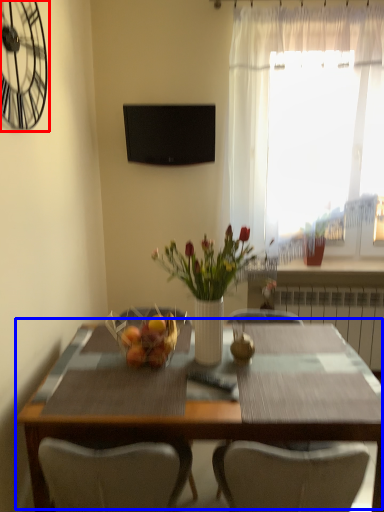
Question: Which of the following is the farthest to the observer, clock (highlighted by a red box) or table (highlighted by a blue box)?

Choices:
 (A) clock
 (B) table

Answer: (B)